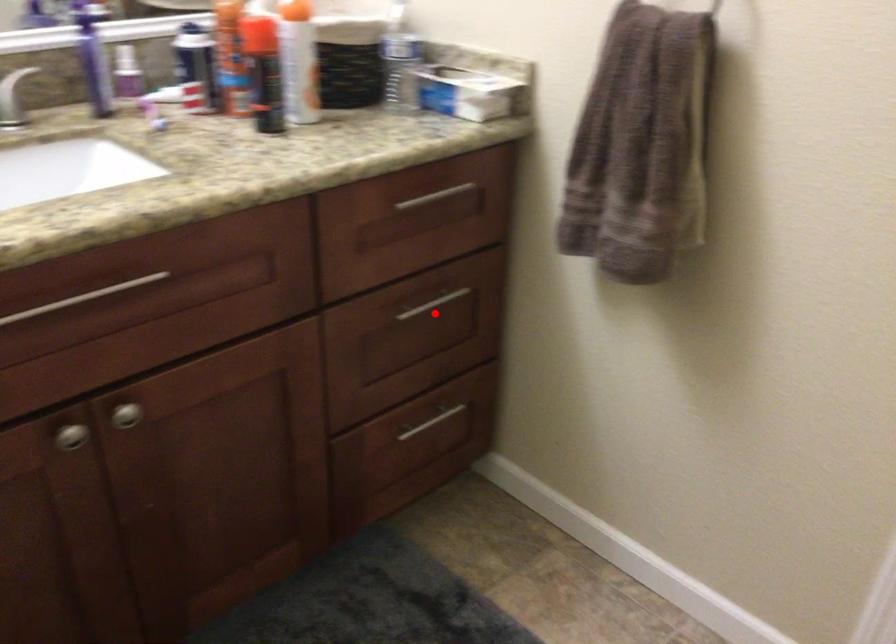
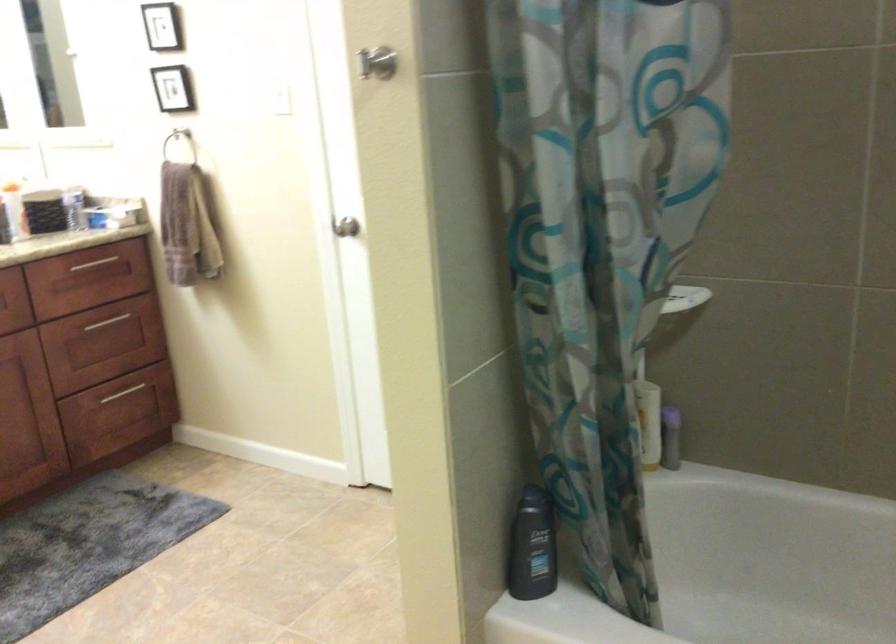
Question: I am providing you with two images of the same scene from different viewpoints. In image1, a red point is highlighted. Considering the same 3D point in image2, which of the following is correct?

Choices:
 (A) It is closer
 (B) It is farther

Answer: (B)